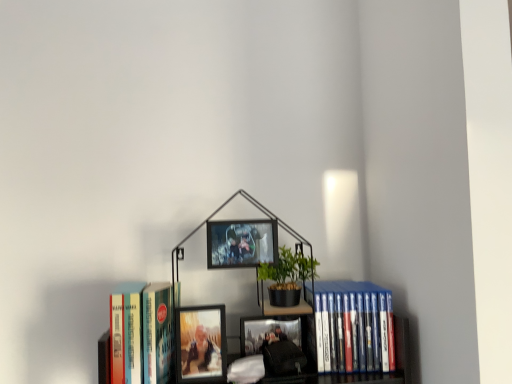
Question: Does matte glass photo frame at center, which ranks as the first picture frame in bottom-to-top order, have a lesser width compared to metallic silver picture frame at center, marked as the 2th picture frame in a bottom-to-top arrangement?

Choices:
 (A) no
 (B) yes

Answer: (B)

Question: From a real-world perspective, is matte glass photo frame at center, which ranks as the first picture frame in bottom-to-top order, physically below metallic silver picture frame at center, which is the 1th picture frame from top to bottom?

Choices:
 (A) no
 (B) yes

Answer: (B)

Question: Is matte glass photo frame at center, the 2th picture frame in the top-to-bottom sequence, far from metallic silver picture frame at center, marked as the 2th picture frame in a bottom-to-top arrangement?

Choices:
 (A) no
 (B) yes

Answer: (A)

Question: From the image's perspective, is matte glass photo frame at center, which ranks as the first picture frame in bottom-to-top order, located above metallic silver picture frame at center, which is the 1th picture frame from top to bottom?

Choices:
 (A) no
 (B) yes

Answer: (A)

Question: Does matte glass photo frame at center, which ranks as the first picture frame in bottom-to-top order, contain metallic silver picture frame at center, marked as the 2th picture frame in a bottom-to-top arrangement?

Choices:
 (A) no
 (B) yes

Answer: (A)

Question: Is matte glass photo frame at center, the 2th picture frame in the top-to-bottom sequence, wider than metallic silver picture frame at center, marked as the 2th picture frame in a bottom-to-top arrangement?

Choices:
 (A) yes
 (B) no

Answer: (B)

Question: Does metallic silver picture frame at center, which is the 1th picture frame from top to bottom, have a lesser width compared to hardcover book at left, placed as the second book when sorted from right to left?

Choices:
 (A) no
 (B) yes

Answer: (B)

Question: Is metallic silver picture frame at center, marked as the 2th picture frame in a bottom-to-top arrangement, shorter than hardcover book at left, placed as the second book when sorted from right to left?

Choices:
 (A) no
 (B) yes

Answer: (B)

Question: From a real-world perspective, is metallic silver picture frame at center, which is the 1th picture frame from top to bottom, below hardcover book at left, marked as the 1th book in a left-to-right arrangement?

Choices:
 (A) yes
 (B) no

Answer: (B)

Question: Considering the relative positions of metallic silver picture frame at center, marked as the 2th picture frame in a bottom-to-top arrangement, and hardcover book at left, marked as the 1th book in a left-to-right arrangement, in the image provided, is metallic silver picture frame at center, marked as the 2th picture frame in a bottom-to-top arrangement, behind hardcover book at left, marked as the 1th book in a left-to-right arrangement,?

Choices:
 (A) yes
 (B) no

Answer: (A)

Question: Is metallic silver picture frame at center, marked as the 2th picture frame in a bottom-to-top arrangement, not inside hardcover book at left, marked as the 1th book in a left-to-right arrangement?

Choices:
 (A) yes
 (B) no

Answer: (A)

Question: Is metallic silver picture frame at center, marked as the 2th picture frame in a bottom-to-top arrangement, at the left side of hardcover book at left, marked as the 1th book in a left-to-right arrangement?

Choices:
 (A) no
 (B) yes

Answer: (A)

Question: Is hardcover book at left, marked as the 1th book in a left-to-right arrangement, not close to metallic silver picture frame at center, which is the 1th picture frame from top to bottom?

Choices:
 (A) yes
 (B) no

Answer: (B)